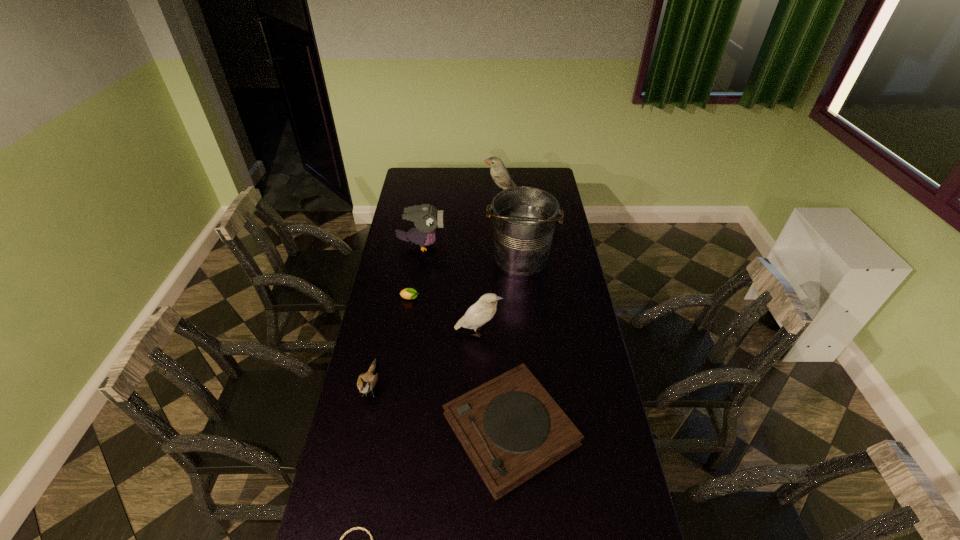
This screenshot has height=540, width=960. Identify the location of empty location between the second farthest bird and the lemon. (416, 272).

Identify which object is the fourth nearest to the shortest bird. Please provide its 2D coordinates. Your answer should be formatted as a tuple, i.e. [(x, y)], where the tuple contains the x and y coordinates of a point satisfying the conditions above.

[(354, 528)]

Locate an element on the screen. object that is the fourth closest to the second farthest bird is located at coordinates (484, 309).

Identify which bird is the third closest to the farthest bird. Please provide its 2D coordinates. Your answer should be formatted as a tuple, i.e. [(x, y)], where the tuple contains the x and y coordinates of a point satisfying the conditions above.

[(366, 382)]

Find the location of a particular element. The width and height of the screenshot is (960, 540). the closest bird to the third farthest bird is located at coordinates (366, 382).

The width and height of the screenshot is (960, 540). I want to click on vacant space that satisfies the following two spatial constraints: 1. with leaves positioned above the seventh tallest object; 2. at the face of the fifth tallest object, so 396,384.

Locate an element on the screen. The width and height of the screenshot is (960, 540). free space that satisfies the following two spatial constraints: 1. at the beak of the phonograph record; 2. on the left side of the second farthest bird is located at coordinates (393, 429).

Identify the location of free spot that satisfies the following two spatial constraints: 1. at the face of the bucket; 2. on the left side of the farthest bird. (505, 259).

At what (x,y) coordinates should I click in order to perform the action: click on free location that satisfies the following two spatial constraints: 1. with leaves positioned above the lemon; 2. at the face of the nearest bird. Please return your answer as a coordinate pair (x, y). The width and height of the screenshot is (960, 540). Looking at the image, I should click on (396, 384).

You are a GUI agent. You are given a task and a screenshot of the screen. Output one action in this format:
    pyautogui.click(x=<x>, y=<y>)
    Task: Click on the vacant area that satisfies the following two spatial constraints: 1. at the beak of the third nearest bird; 2. on the back side of the phonograph record
    This screenshot has height=540, width=960.
    Given the screenshot: What is the action you would take?
    pyautogui.click(x=393, y=429)